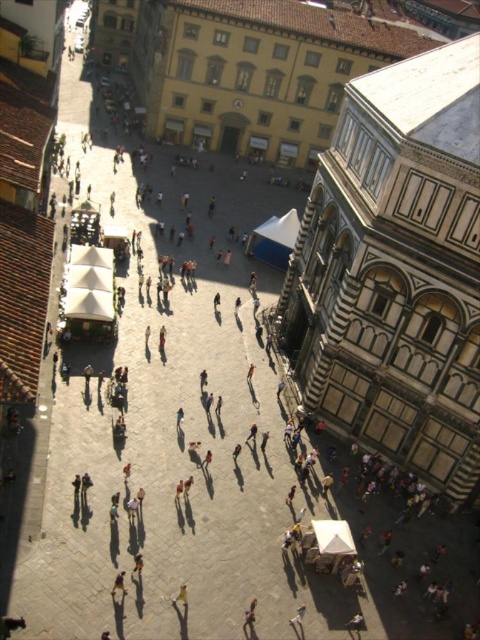
Is light brown leather jacket at lower left shorter than light brown wooden chair at center?

No.

Which is more to the left, light brown leather jacket at lower left or light brown wooden chair at center?

Positioned to the left is light brown leather jacket at lower left.

Which is behind, point (122, 588) or point (180, 588)?

The point (180, 588) is more distant.

The image size is (480, 640). Identify the location of light brown leather jacket at lower left. (119, 584).

Which is behind, point (302, 605) or point (186, 589)?

Point (302, 605)

Does light brown leather jacket at lower center have a larger size compared to light brown wooden chair at center?

Yes.

Where is `light brown leather jacket at lower center`? The height and width of the screenshot is (640, 480). light brown leather jacket at lower center is located at coordinates (299, 621).

Does light brown leather jacket at lower center have a lesser width compared to light brown leather jacket at lower left?

No, light brown leather jacket at lower center is not thinner than light brown leather jacket at lower left.

Is point (294, 627) closer to camera compared to point (123, 586)?

That is False.

Locate an element on the screen. light brown leather jacket at lower center is located at coordinates (299, 621).